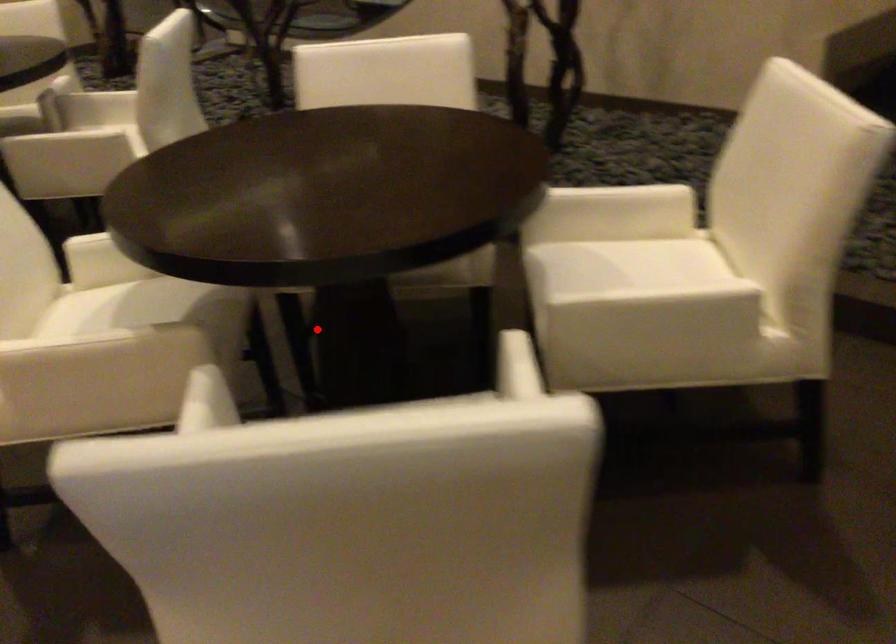
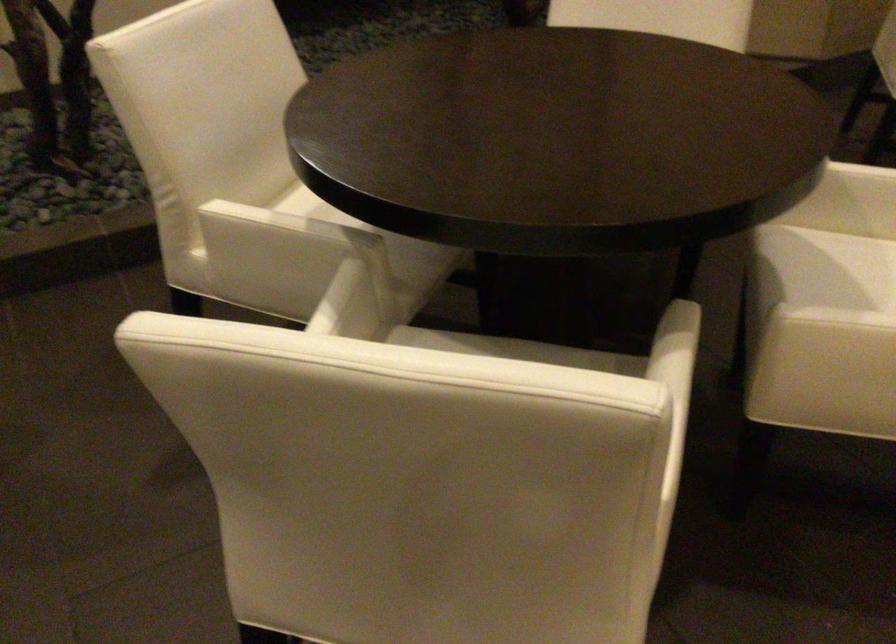
Question: I am providing you with two images of the same scene from different viewpoints. In image1, a red point is highlighted. Considering the same 3D point in image2, which of the following is correct?

Choices:
 (A) It is closer
 (B) It is farther

Answer: (A)